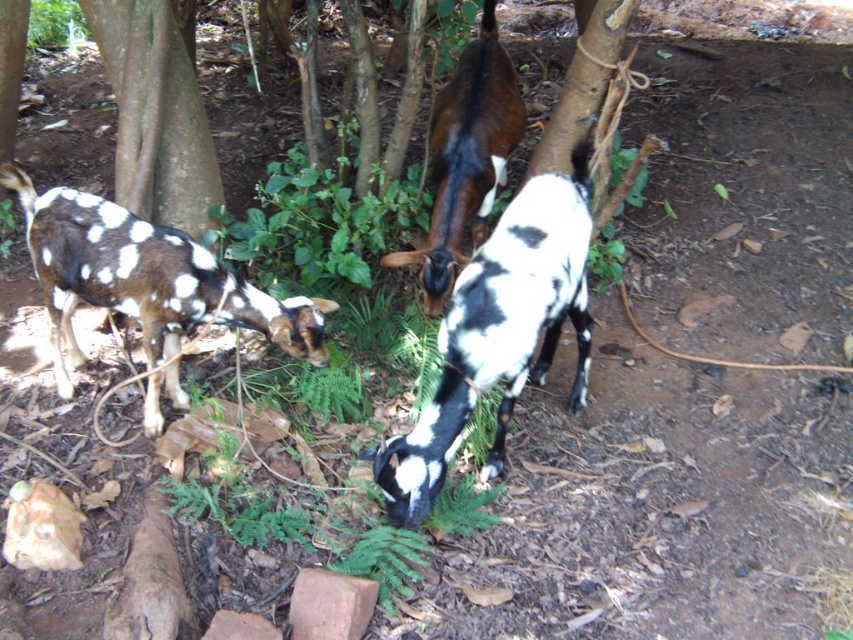
What do you see at coordinates (155, 115) in the screenshot?
I see `brown rough tree trunk at upper left` at bounding box center [155, 115].

Does brown rough tree trunk at upper left come in front of red clay brick at lower center?

No, it is not.

Is point (100, 33) more distant than point (309, 596)?

Yes.

Find the location of a particular element. brown rough tree trunk at upper left is located at coordinates (155, 115).

Is point (404, 449) more distant than point (195, 294)?

No.

You are a GUI agent. You are given a task and a screenshot of the screen. Output one action in this format:
    pyautogui.click(x=<x>, y=<y>)
    Task: Click on the spotted fur goat at center
    
    Given the screenshot: What is the action you would take?
    pyautogui.click(x=498, y=333)

Which is in front, point (582, 372) or point (244, 305)?

Positioned in front is point (244, 305).

You are a GUI agent. You are given a task and a screenshot of the screen. Output one action in this format:
    pyautogui.click(x=<x>, y=<y>)
    Task: Click on the spotted fur goat at center
    Image resolution: width=853 pixels, height=640 pixels.
    Given the screenshot: What is the action you would take?
    pyautogui.click(x=498, y=333)

Is spotted fur goat at center wider than brown rough tree trunk at upper left?

Yes, spotted fur goat at center is wider than brown rough tree trunk at upper left.

Is spotted fur goat at center taller than brown rough tree trunk at upper left?

Yes, spotted fur goat at center is taller than brown rough tree trunk at upper left.

Is point (498, 285) less distant than point (171, 49)?

Yes, point (498, 285) is closer to viewer.

I want to click on spotted fur goat at center, so click(x=498, y=333).